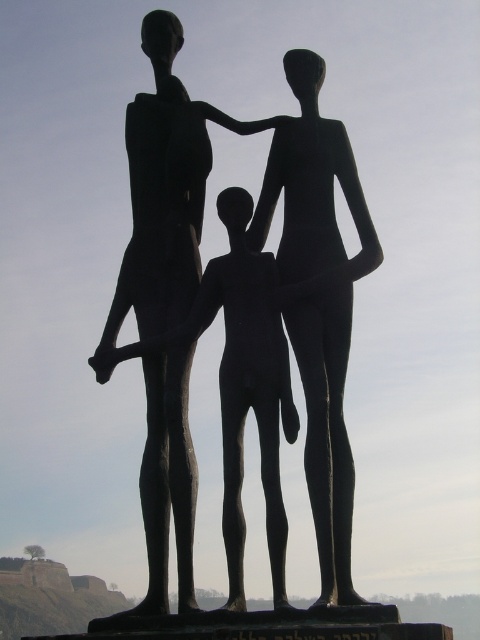
Is bronze statue at center bigger than black matte statue at center?

Yes, bronze statue at center is bigger than black matte statue at center.

Locate an element on the screen. The height and width of the screenshot is (640, 480). bronze statue at center is located at coordinates (320, 301).

Measure the distance between point (154, 214) and camera.

Point (154, 214) is 72.76 meters away from camera.

This screenshot has width=480, height=640. Identify the location of bronze statue at center. (320, 301).